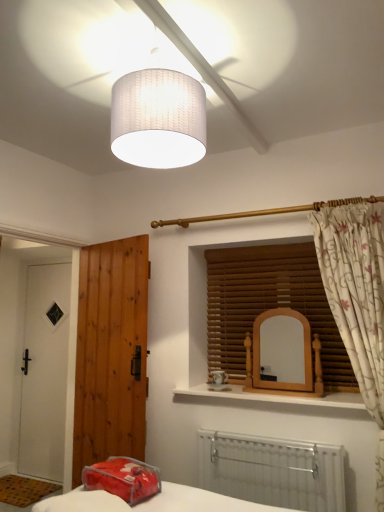
Question: Considering their positions, is wooden mirror at center located in front of or behind white textured lampshade at upper center?

Choices:
 (A) front
 (B) behind

Answer: (B)

Question: Considering the relative positions of wooden mirror at center and white textured lampshade at upper center in the image provided, is wooden mirror at center to the left or to the right of white textured lampshade at upper center?

Choices:
 (A) left
 (B) right

Answer: (B)

Question: Which of these objects is positioned closest to the brown wooden door at left, acting as the 1th door starting from the front?

Choices:
 (A) wooden blinds at center
 (B) white metallic radiator at lower center
 (C) floral fabric curtain at right
 (D) white textured lampshade at upper center
 (E) wooden mirror at center

Answer: (A)

Question: Which of these objects is positioned closest to the floral fabric curtain at right?

Choices:
 (A) white textured lampshade at upper center
 (B) wooden blinds at center
 (C) translucent plastic pillow at lower center
 (D) brown wooden door at left, acting as the first door starting from the right
 (E) wooden mirror at center

Answer: (E)